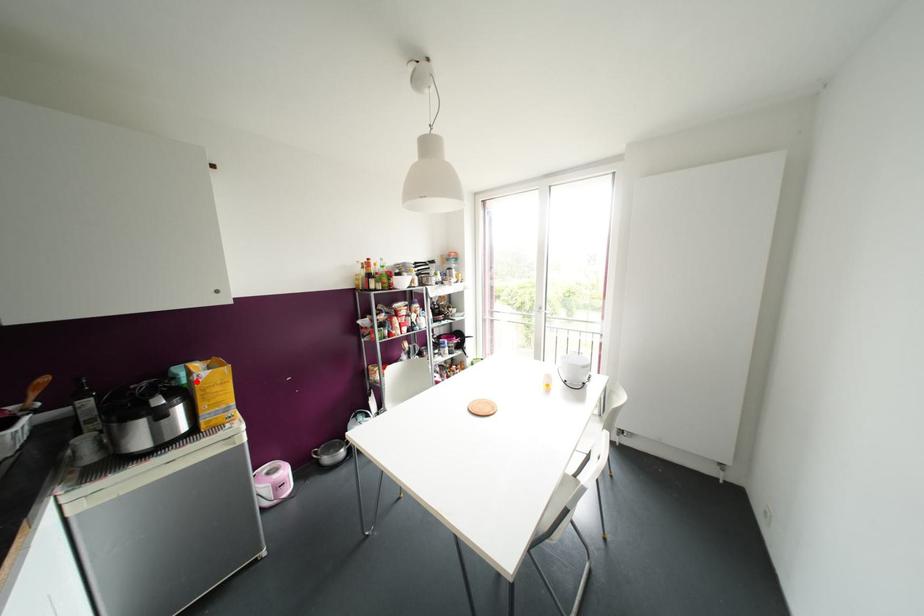
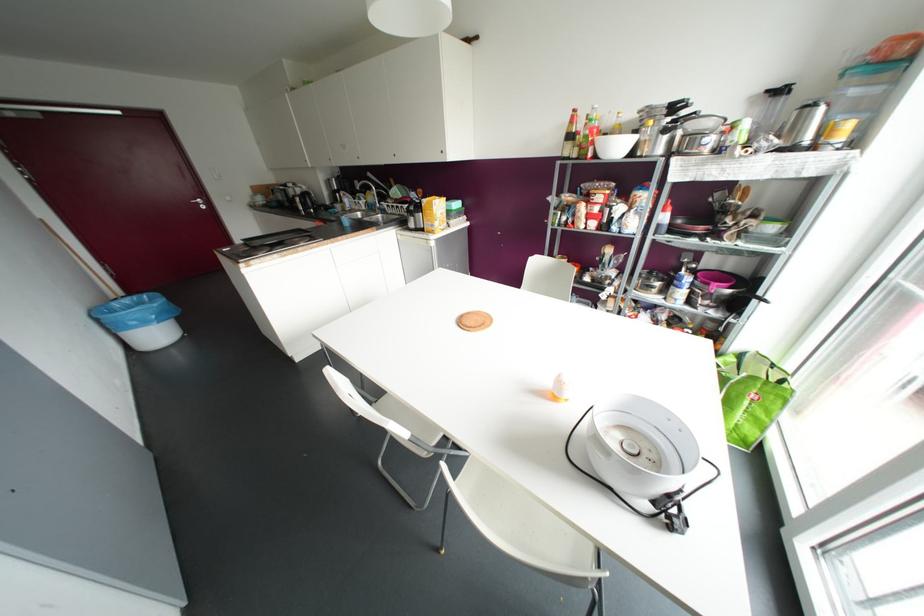
Question: I am providing you with two images of the same scene from different viewpoints. Image1 has a red point marked. In image2, the corresponding 3D location appears at what relative position? Reply with the corresponding letter.

Choices:
 (A) Closer
 (B) Farther

Answer: (A)